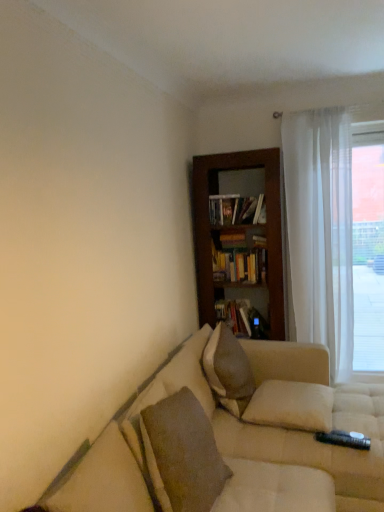
Question: Is hardcover books at center, which appears as the first book when viewed from the top, bigger than beige fabric couch at lower right?

Choices:
 (A) no
 (B) yes

Answer: (A)

Question: Considering the relative positions of hardcover books at center, which appears as the first book when viewed from the top, and beige fabric couch at lower right in the image provided, is hardcover books at center, which appears as the first book when viewed from the top, to the right of beige fabric couch at lower right from the viewer's perspective?

Choices:
 (A) yes
 (B) no

Answer: (B)

Question: From the image's perspective, is hardcover books at center, arranged as the 2th book when ordered from the bottom, above beige fabric couch at lower right?

Choices:
 (A) no
 (B) yes

Answer: (B)

Question: Is hardcover books at center, arranged as the 2th book when ordered from the bottom, not inside beige fabric couch at lower right?

Choices:
 (A) yes
 (B) no

Answer: (A)

Question: Considering the relative positions of hardcover books at center, arranged as the 2th book when ordered from the bottom, and beige fabric couch at lower right in the image provided, is hardcover books at center, arranged as the 2th book when ordered from the bottom, to the left of beige fabric couch at lower right from the viewer's perspective?

Choices:
 (A) yes
 (B) no

Answer: (A)

Question: Is hardcover books at center, arranged as the 2th book when ordered from the bottom, with beige fabric couch at lower right?

Choices:
 (A) yes
 (B) no

Answer: (B)

Question: From the image's perspective, would you say hardcover book at center, the second book in the top-to-bottom sequence, is shown under textured beige pillow at lower left, the 1th pillow positioned from the front?

Choices:
 (A) no
 (B) yes

Answer: (A)

Question: Is hardcover book at center, the second book in the top-to-bottom sequence, shorter than textured beige pillow at lower left, the 1th pillow positioned from the front?

Choices:
 (A) no
 (B) yes

Answer: (B)

Question: Does hardcover book at center, the second book in the top-to-bottom sequence, have a lesser width compared to textured beige pillow at lower left, arranged as the third pillow when viewed from the back?

Choices:
 (A) no
 (B) yes

Answer: (A)

Question: From the image's perspective, would you say hardcover book at center, the second book in the top-to-bottom sequence, is positioned over textured beige pillow at lower left, arranged as the third pillow when viewed from the back?

Choices:
 (A) yes
 (B) no

Answer: (A)

Question: Is hardcover book at center, positioned as the 1th book in bottom-to-top order, with textured beige pillow at lower left, the 1th pillow positioned from the front?

Choices:
 (A) yes
 (B) no

Answer: (B)

Question: Could you tell me if hardcover book at center, positioned as the 1th book in bottom-to-top order, is turned towards textured beige pillow at lower left, arranged as the third pillow when viewed from the back?

Choices:
 (A) yes
 (B) no

Answer: (A)

Question: From a real-world perspective, is beige fabric couch at lower right over white sheer curtain at right?

Choices:
 (A) no
 (B) yes

Answer: (A)